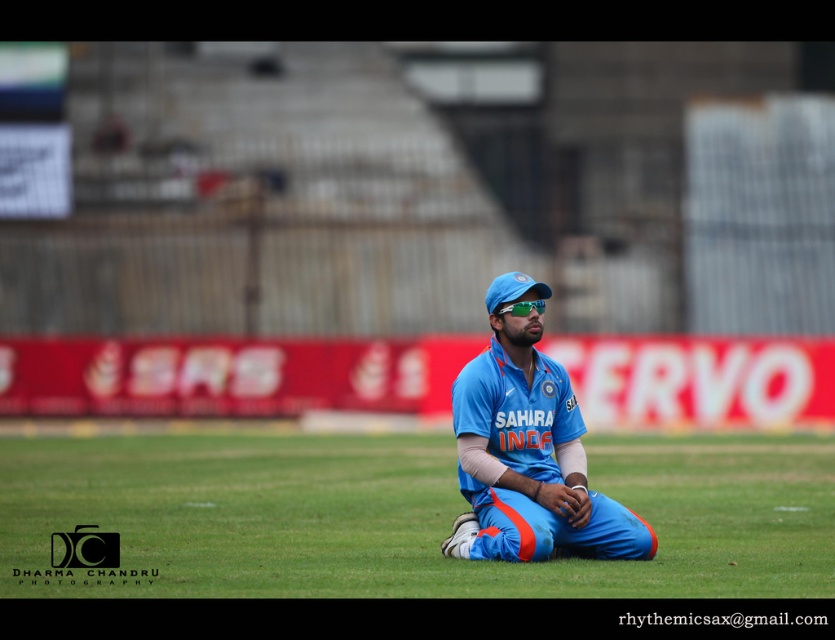
You are a photographer positioned at the edge of the field. You want to take a photo of the blue fabric baseball cap at center without the green grass at center appearing in the foreground. Is this possible?

The green grass at center is below the blue fabric baseball cap at center, so if you position yourself so that the cap is above the grass in the frame, the grass won me not be in the foreground. This should be possible by angling the camera upward to focus on the cap while keeping the grass out of the lower part of the shot.

You are a photographer standing at the edge of the cricket field. You need to position yourself so that the green grass at center and the blue fabric uniform at center are both visible in your shot. Based on their positions, which object should appear to your left when you look through the camera?

The green grass at center is to the left of the blue fabric uniform at center, so when looking through the camera, the green grass at center will appear to your left side.